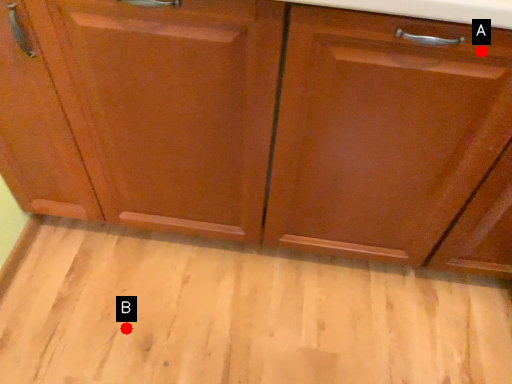
Question: Two points are circled on the image, labeled by A and B beside each circle. Which of the following is the closest to the observer?

Choices:
 (A) A is closer
 (B) B is closer

Answer: (A)